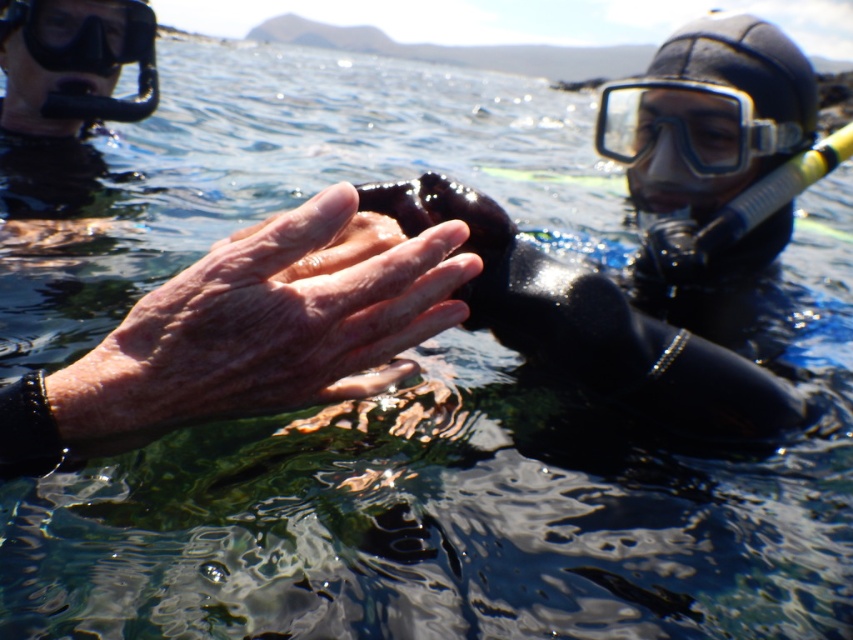
Question: Is dry skin hand at center positioned before black matte goggles at upper left?

Choices:
 (A) yes
 (B) no

Answer: (A)

Question: Is clear plastic goggles at upper right closer to the viewer compared to black matte goggles at upper left?

Choices:
 (A) yes
 (B) no

Answer: (A)

Question: Considering the relative positions of dry skin hand at center and clear plastic goggles at upper right in the image provided, where is dry skin hand at center located with respect to clear plastic goggles at upper right?

Choices:
 (A) right
 (B) left

Answer: (B)

Question: Based on their relative distances, which object is farther from the black matte goggles at upper left?

Choices:
 (A) dry skin hand at center
 (B) clear plastic goggles at upper right

Answer: (A)

Question: Which point is closer to the camera taking this photo?

Choices:
 (A) (694, 138)
 (B) (111, 410)

Answer: (B)

Question: Estimate the real-world distances between objects in this image. Which object is closer to the black matte goggles at upper left?

Choices:
 (A) clear plastic goggles at upper right
 (B) dry skin hand at center

Answer: (A)